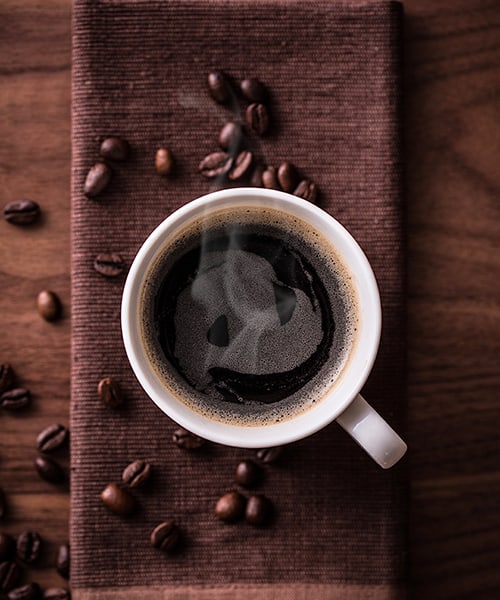
Identify the location of grain lines in wood table. Image resolution: width=500 pixels, height=600 pixels. (466, 373), (464, 237), (456, 476), (458, 526), (53, 394), (20, 472), (52, 522).